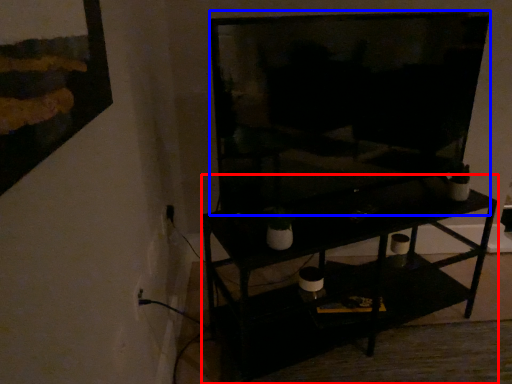
Question: Which of the following is the closest to the observer, shelf (highlighted by a red box) or television (highlighted by a blue box)?

Choices:
 (A) shelf
 (B) television

Answer: (B)